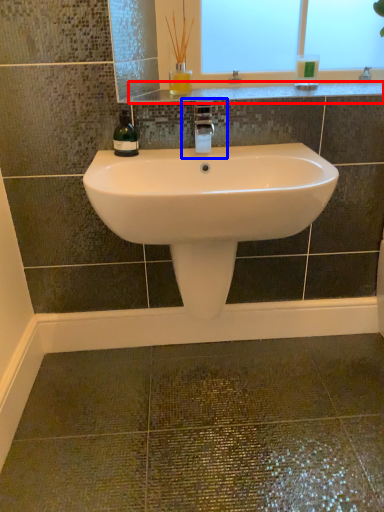
Question: Which of the following is the farthest to the observer, counter top (highlighted by a red box) or plumbing fixture (highlighted by a blue box)?

Choices:
 (A) counter top
 (B) plumbing fixture

Answer: (A)